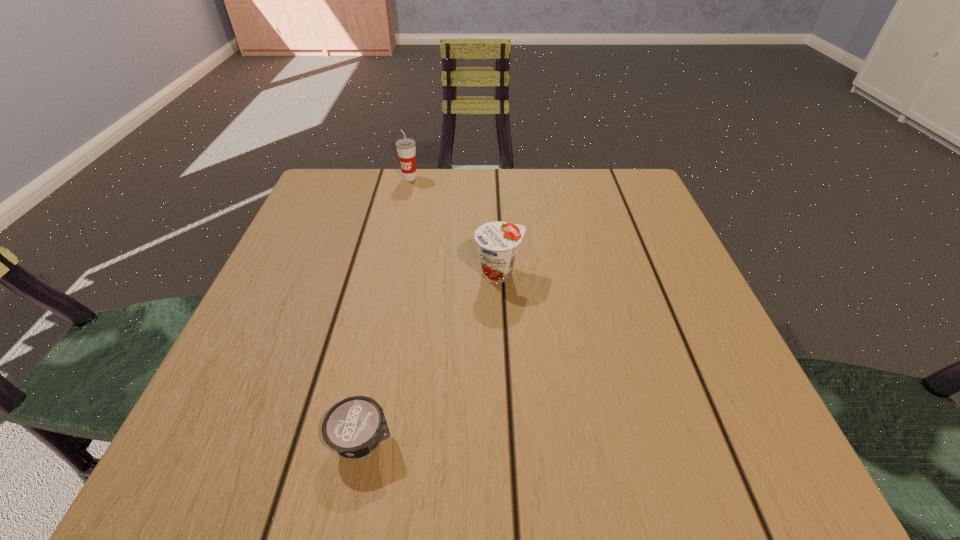
Where is `free region that satisfies the following two spatial constraints: 1. on the side of the farthest object with the logo; 2. on the left side of the nearest object`? The width and height of the screenshot is (960, 540). free region that satisfies the following two spatial constraints: 1. on the side of the farthest object with the logo; 2. on the left side of the nearest object is located at coordinates (350, 440).

Where is `free spot that satisfies the following two spatial constraints: 1. on the side of the cup with the logo; 2. on the left side of the shorter yogurt`? free spot that satisfies the following two spatial constraints: 1. on the side of the cup with the logo; 2. on the left side of the shorter yogurt is located at coordinates (350, 440).

Identify the location of free spot that satisfies the following two spatial constraints: 1. on the side of the cup with the logo; 2. on the left side of the taller yogurt. The width and height of the screenshot is (960, 540). (388, 273).

The height and width of the screenshot is (540, 960). Find the location of `free space that satisfies the following two spatial constraints: 1. on the back side of the right yogurt; 2. on the left side of the nearest object`. free space that satisfies the following two spatial constraints: 1. on the back side of the right yogurt; 2. on the left side of the nearest object is located at coordinates (397, 273).

At what (x,y) coordinates should I click in order to perform the action: click on vacant space that satisfies the following two spatial constraints: 1. on the side of the nearest object with the logo; 2. on the right side of the farthest object. Please return your answer as a coordinate pair (x, y). Looking at the image, I should click on (350, 440).

Where is `free spot that satisfies the following two spatial constraints: 1. on the side of the rightmost object with the logo; 2. on the right side of the cup`? This screenshot has height=540, width=960. free spot that satisfies the following two spatial constraints: 1. on the side of the rightmost object with the logo; 2. on the right side of the cup is located at coordinates (388, 273).

Locate an element on the screen. The width and height of the screenshot is (960, 540). vacant region that satisfies the following two spatial constraints: 1. on the side of the left yogurt with the logo; 2. on the left side of the tallest object is located at coordinates (350, 440).